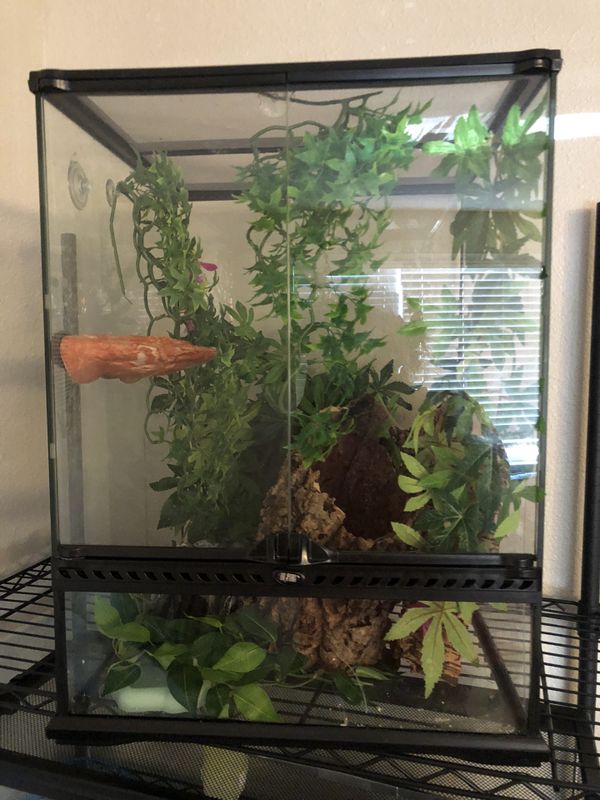
The image size is (600, 800). I want to click on glass doors, so click(235, 129), click(322, 114).